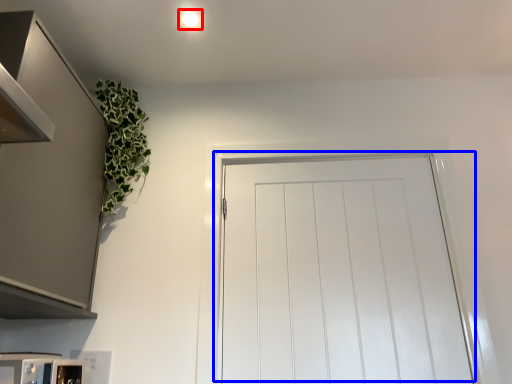
Question: Which object is closer to the camera taking this photo, lighting (highlighted by a red box) or door (highlighted by a blue box)?

Choices:
 (A) lighting
 (B) door

Answer: (B)